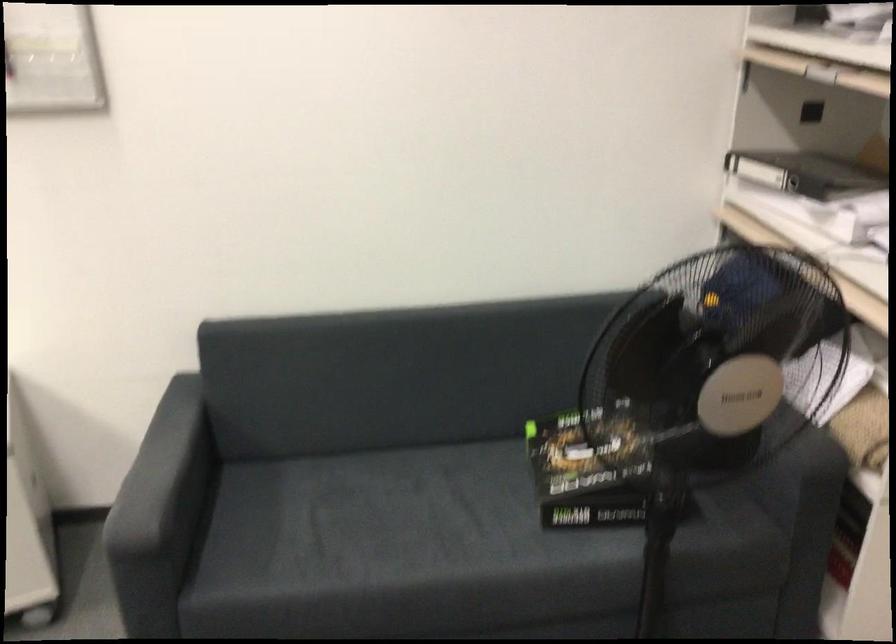
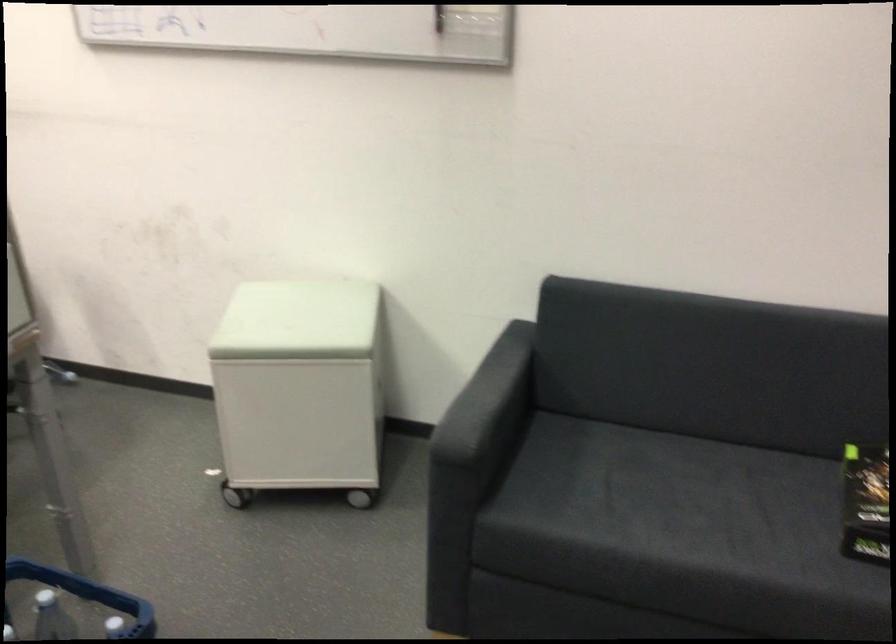
Question: The images are taken continuously from a first-person perspective. In which direction is your viewpoint rotating?

Choices:
 (A) Left
 (B) Right
 (C) Up
 (D) Down

Answer: (A)